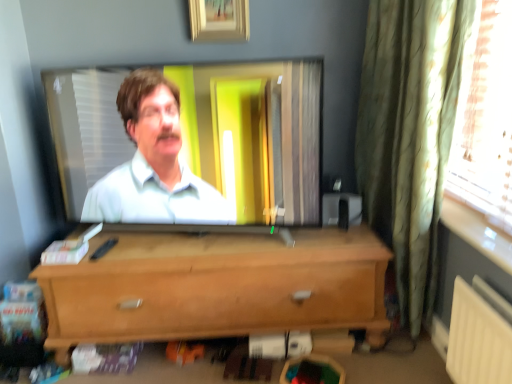
Question: Should I look upward or downward to see wooden picture frame at upper center?

Choices:
 (A) up
 (B) down

Answer: (A)

Question: From the image's perspective, would you say green textured curtain at right is positioned over wooden picture frame at upper center?

Choices:
 (A) yes
 (B) no

Answer: (B)

Question: Considering the relative sizes of green textured curtain at right and wooden picture frame at upper center in the image provided, is green textured curtain at right thinner than wooden picture frame at upper center?

Choices:
 (A) yes
 (B) no

Answer: (B)

Question: Considering the relative sizes of green textured curtain at right and wooden picture frame at upper center in the image provided, is green textured curtain at right bigger than wooden picture frame at upper center?

Choices:
 (A) yes
 (B) no

Answer: (A)

Question: From the image's perspective, would you say green textured curtain at right is shown under wooden picture frame at upper center?

Choices:
 (A) yes
 (B) no

Answer: (A)

Question: Can you confirm if green textured curtain at right is taller than wooden picture frame at upper center?

Choices:
 (A) no
 (B) yes

Answer: (B)

Question: Considering the relative sizes of green textured curtain at right and wooden picture frame at upper center in the image provided, is green textured curtain at right smaller than wooden picture frame at upper center?

Choices:
 (A) no
 (B) yes

Answer: (A)

Question: Does light brown wood chest of drawers at center turn towards wooden picture frame at upper center?

Choices:
 (A) yes
 (B) no

Answer: (B)

Question: Does light brown wood chest of drawers at center have a smaller size compared to wooden picture frame at upper center?

Choices:
 (A) yes
 (B) no

Answer: (B)

Question: From a real-world perspective, is light brown wood chest of drawers at center on wooden picture frame at upper center?

Choices:
 (A) yes
 (B) no

Answer: (B)

Question: Does light brown wood chest of drawers at center lie behind wooden picture frame at upper center?

Choices:
 (A) no
 (B) yes

Answer: (A)

Question: Can you confirm if light brown wood chest of drawers at center is bigger than wooden picture frame at upper center?

Choices:
 (A) no
 (B) yes

Answer: (B)

Question: From a real-world perspective, is light brown wood chest of drawers at center physically below wooden picture frame at upper center?

Choices:
 (A) no
 (B) yes

Answer: (B)

Question: Is light brown wood chest of drawers at center directly adjacent to green textured curtain at right?

Choices:
 (A) no
 (B) yes

Answer: (A)